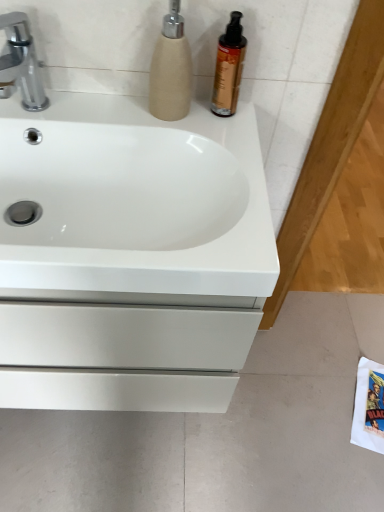
Question: Does silver metallic faucet at upper left have a greater width compared to beige textured soap dispenser at upper center?

Choices:
 (A) no
 (B) yes

Answer: (B)

Question: Considering the relative positions of silver metallic faucet at upper left and beige textured soap dispenser at upper center in the image provided, is silver metallic faucet at upper left in front of beige textured soap dispenser at upper center?

Choices:
 (A) yes
 (B) no

Answer: (A)

Question: Can you confirm if silver metallic faucet at upper left is positioned to the left of beige textured soap dispenser at upper center?

Choices:
 (A) no
 (B) yes

Answer: (B)

Question: From the image's perspective, is silver metallic faucet at upper left over beige textured soap dispenser at upper center?

Choices:
 (A) no
 (B) yes

Answer: (A)

Question: Is silver metallic faucet at upper left to the right of beige textured soap dispenser at upper center from the viewer's perspective?

Choices:
 (A) no
 (B) yes

Answer: (A)

Question: Which is correct: shiny amber bottle at upper right is inside silver metallic faucet at upper left, or outside of it?

Choices:
 (A) inside
 (B) outside

Answer: (B)

Question: From a real-world perspective, is shiny amber bottle at upper right positioned above or below silver metallic faucet at upper left?

Choices:
 (A) above
 (B) below

Answer: (A)

Question: From the image's perspective, is shiny amber bottle at upper right located above or below silver metallic faucet at upper left?

Choices:
 (A) above
 (B) below

Answer: (A)

Question: Considering the positions of shiny amber bottle at upper right and silver metallic faucet at upper left in the image, is shiny amber bottle at upper right wider or thinner than silver metallic faucet at upper left?

Choices:
 (A) thin
 (B) wide

Answer: (A)

Question: From the image's perspective, relative to silver metallic faucet at upper left, is white glossy sink at center above or below?

Choices:
 (A) above
 (B) below

Answer: (B)

Question: In terms of width, does white glossy sink at center look wider or thinner when compared to silver metallic faucet at upper left?

Choices:
 (A) thin
 (B) wide

Answer: (B)

Question: Considering their positions, is white glossy sink at center located in front of or behind silver metallic faucet at upper left?

Choices:
 (A) front
 (B) behind

Answer: (A)

Question: In terms of height, does white glossy sink at center look taller or shorter compared to silver metallic faucet at upper left?

Choices:
 (A) short
 (B) tall

Answer: (A)

Question: Is white glossy sink at center in front of or behind shiny amber bottle at upper right in the image?

Choices:
 (A) front
 (B) behind

Answer: (A)

Question: From the image's perspective, relative to shiny amber bottle at upper right, is white glossy sink at center above or below?

Choices:
 (A) below
 (B) above

Answer: (A)